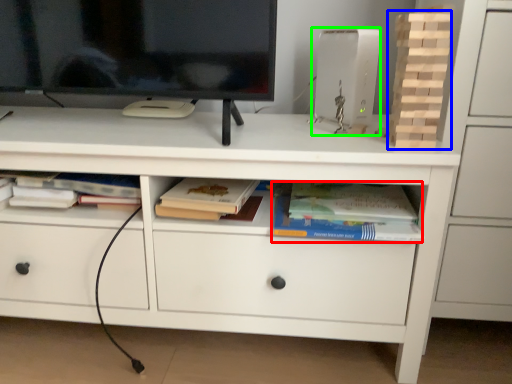
Question: Which is farther away from paperback book (highlighted by a red box)? book (highlighted by a blue box) or equipment (highlighted by a green box)?

Choices:
 (A) book
 (B) equipment

Answer: (B)